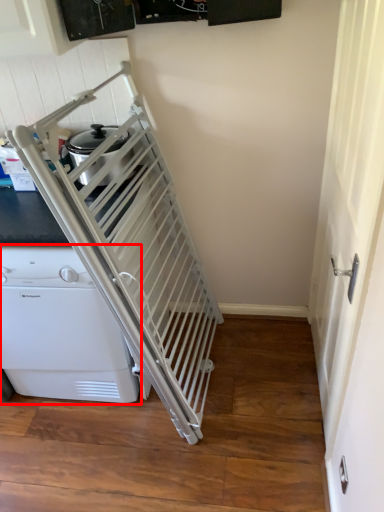
Question: From the image's perspective, where is home appliance (annotated by the red box) located in relation to screen door in the image?

Choices:
 (A) above
 (B) below

Answer: (B)